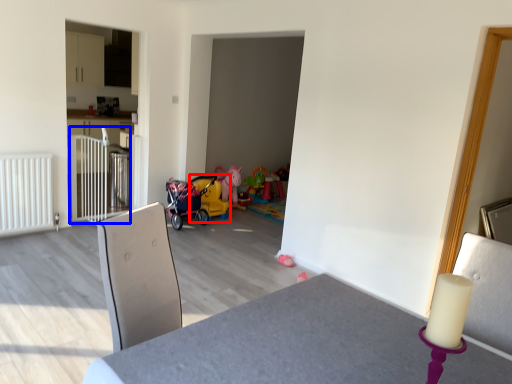
Question: Which point is further to the camera, baby carriage (highlighted by a red box) or rail (highlighted by a blue box)?

Choices:
 (A) baby carriage
 (B) rail

Answer: (A)